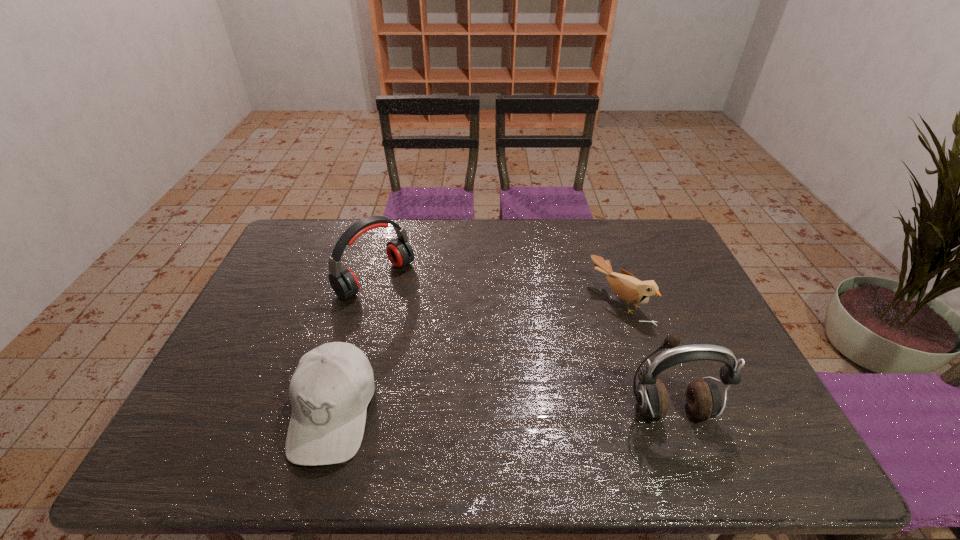
Where is `free space at the right edge of the desktop`? This screenshot has height=540, width=960. free space at the right edge of the desktop is located at coordinates (720, 339).

In the image, there is a desktop. Find the location of `blank space at the near left corner`. blank space at the near left corner is located at coordinates (232, 404).

I want to click on free space that is in between the shorter earphone and the tallest object, so click(x=522, y=345).

Identify the location of vacant point located between the farther earphone and the bird. Image resolution: width=960 pixels, height=540 pixels. (497, 290).

Find the location of a particular element. The image size is (960, 540). empty space that is in between the left earphone and the taller earphone is located at coordinates (522, 345).

You are a GUI agent. You are given a task and a screenshot of the screen. Output one action in this format:
    pyautogui.click(x=<x>, y=<y>)
    Task: Click on the free spot between the bird and the nearer earphone
    The height and width of the screenshot is (540, 960).
    Given the screenshot: What is the action you would take?
    pos(644,356)

The image size is (960, 540). Find the location of `vacant area between the bird and the baseball cap`. vacant area between the bird and the baseball cap is located at coordinates (476, 356).

What are the coordinates of `vacant area between the farther earphone and the bird` in the screenshot? It's located at (497, 290).

Locate an element on the screen. free space between the taller earphone and the bird is located at coordinates (644, 356).

The height and width of the screenshot is (540, 960). Find the location of `free point between the bird and the nearer earphone`. free point between the bird and the nearer earphone is located at coordinates (644, 356).